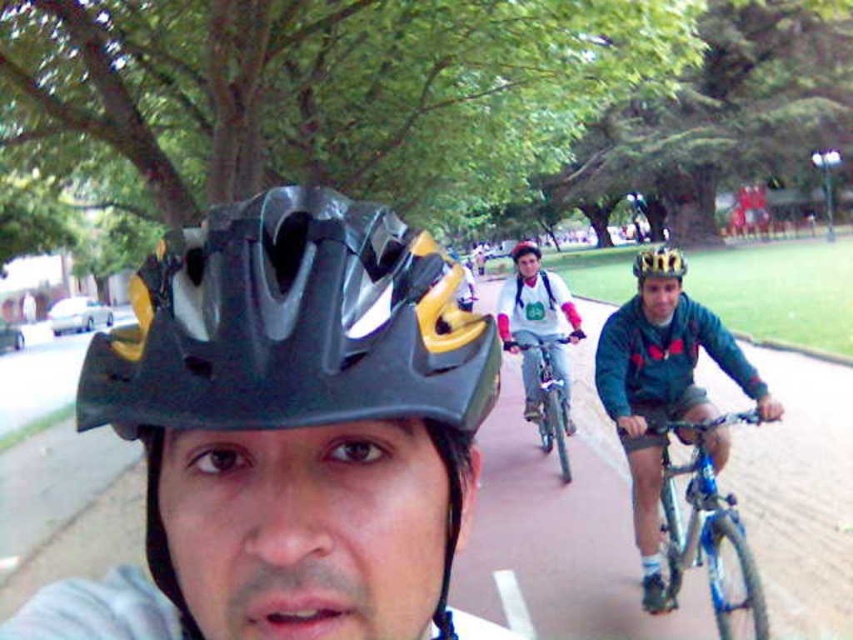
Measure the distance between point (328,348) and camera.

They are 13.17 inches apart.

Can you confirm if black matte bicycle helmet at center is positioned to the right of shiny metallic bicycle at center-right?

Incorrect, black matte bicycle helmet at center is not on the right side of shiny metallic bicycle at center-right.

Measure the distance between point (192, 275) and camera.

Point (192, 275) is 15.49 inches from camera.

Find the location of a particular element. black matte bicycle helmet at center is located at coordinates (291, 324).

Does blue metallic bicycle at center-right have a lesser height compared to shiny metallic bicycle at center-right?

Indeed, blue metallic bicycle at center-right has a lesser height compared to shiny metallic bicycle at center-right.

From the picture: Between blue metallic bicycle at center-right and shiny metallic bicycle at center-right, which one appears on the right side from the viewer's perspective?

Positioned to the right is blue metallic bicycle at center-right.

Between point (672, 512) and point (502, 342), which one is positioned behind?

Positioned behind is point (502, 342).

You are a GUI agent. You are given a task and a screenshot of the screen. Output one action in this format:
    pyautogui.click(x=<x>, y=<y>)
    Task: Click on the blue metallic bicycle at center-right
    This screenshot has width=853, height=640.
    Given the screenshot: What is the action you would take?
    pyautogui.click(x=706, y=525)

Which is behind, point (339, 540) or point (625, 372)?

The point (625, 372) is behind.

Can you confirm if black matte helmet at center is positioned above matte blue bicycle at right?

Yes.

Who is more forward, (x=222, y=236) or (x=651, y=600)?

Positioned in front is point (x=222, y=236).

Locate an element on the screen. This screenshot has height=640, width=853. black matte helmet at center is located at coordinates (287, 429).